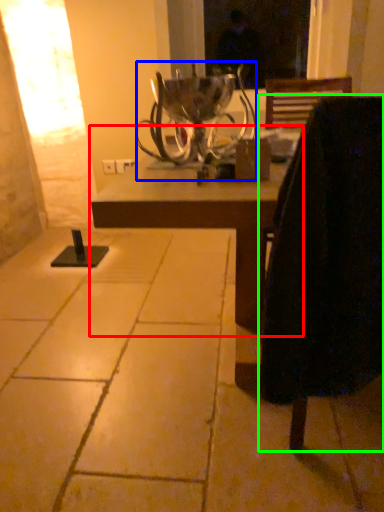
Question: Estimate the real-world distances between objects in this image. Which object is farther from table (highlighted by a red box), candle holder (highlighted by a blue box) or chair (highlighted by a green box)?

Choices:
 (A) candle holder
 (B) chair

Answer: (A)